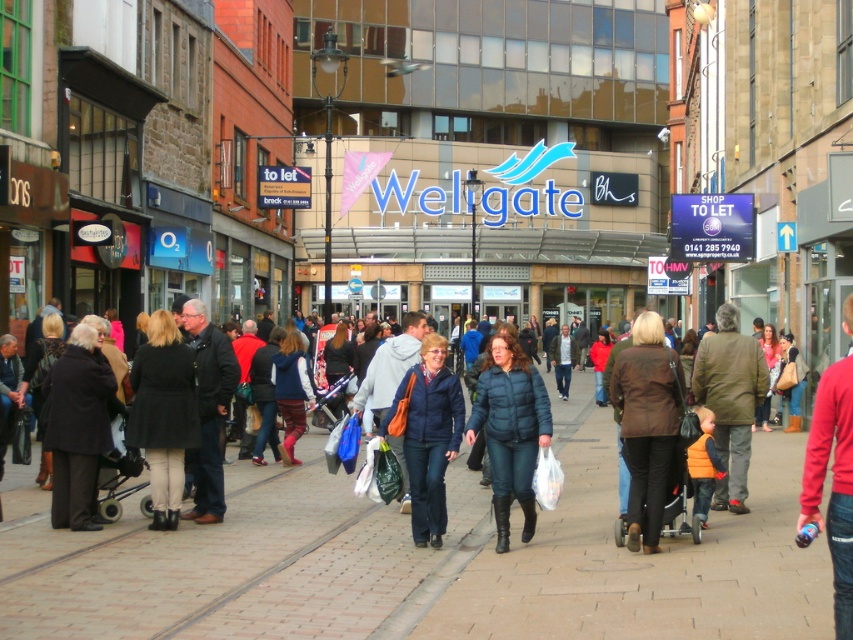
Question: Which of these objects is positioned closest to the dark blue puffer jacket at center?

Choices:
 (A) matte blue jacket at center
 (B) dark gray coat at left
 (C) brown leather jacket at center

Answer: (A)

Question: In this image, where is dark blue puffer jacket at center located relative to dark gray coat at left?

Choices:
 (A) left
 (B) right

Answer: (B)

Question: Does dark blue puffer jacket at center have a lesser width compared to matte blue jacket at center?

Choices:
 (A) no
 (B) yes

Answer: (B)

Question: Among these points, which one is farthest from the camera?

Choices:
 (A) (741, 520)
 (B) (503, 483)

Answer: (A)

Question: Can you confirm if brick pavement at center is positioned to the left of matte blue jacket at center?

Choices:
 (A) no
 (B) yes

Answer: (B)

Question: Among these points, which one is farthest from the camera?

Choices:
 (A) (502, 483)
 (B) (727, 380)
 (C) (86, 381)
 (D) (347, 529)

Answer: (B)